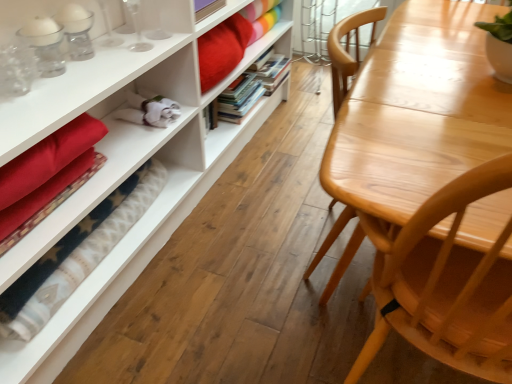
Question: Is the position of hardcover books at center, the 2th book viewed from the front, more distant than that of velvet red blanket at lower left?

Choices:
 (A) no
 (B) yes

Answer: (B)

Question: Is hardcover books at center, arranged as the first book when viewed from the back, shorter than velvet red blanket at lower left?

Choices:
 (A) no
 (B) yes

Answer: (A)

Question: Is hardcover books at center, arranged as the first book when viewed from the back, at the left side of velvet red blanket at lower left?

Choices:
 (A) no
 (B) yes

Answer: (A)

Question: Is hardcover books at center, arranged as the first book when viewed from the back, facing towards velvet red blanket at lower left?

Choices:
 (A) yes
 (B) no

Answer: (B)

Question: Does hardcover books at center, arranged as the first book when viewed from the back, contain velvet red blanket at lower left?

Choices:
 (A) yes
 (B) no

Answer: (B)

Question: Is hardcover books at center, the 2th book viewed from the front, turned away from velvet red blanket at lower left?

Choices:
 (A) no
 (B) yes

Answer: (A)

Question: From the image's perspective, does light wood table at right appear higher than hardcover books at center, positioned as the first book in front-to-back order?

Choices:
 (A) yes
 (B) no

Answer: (B)

Question: Is light wood table at right outside of hardcover books at center, positioned as the first book in front-to-back order?

Choices:
 (A) no
 (B) yes

Answer: (B)

Question: Is light wood table at right smaller than hardcover books at center, arranged as the second book when viewed from the back?

Choices:
 (A) yes
 (B) no

Answer: (B)

Question: Can you confirm if light wood table at right is taller than hardcover books at center, arranged as the second book when viewed from the back?

Choices:
 (A) no
 (B) yes

Answer: (B)

Question: From a real-world perspective, is light wood table at right positioned over hardcover books at center, positioned as the first book in front-to-back order, based on gravity?

Choices:
 (A) yes
 (B) no

Answer: (A)

Question: Is light wood table at right wider than hardcover books at center, positioned as the first book in front-to-back order?

Choices:
 (A) no
 (B) yes

Answer: (B)

Question: Does matte white bookcase at left have a lesser height compared to hardcover books at center, arranged as the first book when viewed from the back?

Choices:
 (A) no
 (B) yes

Answer: (B)